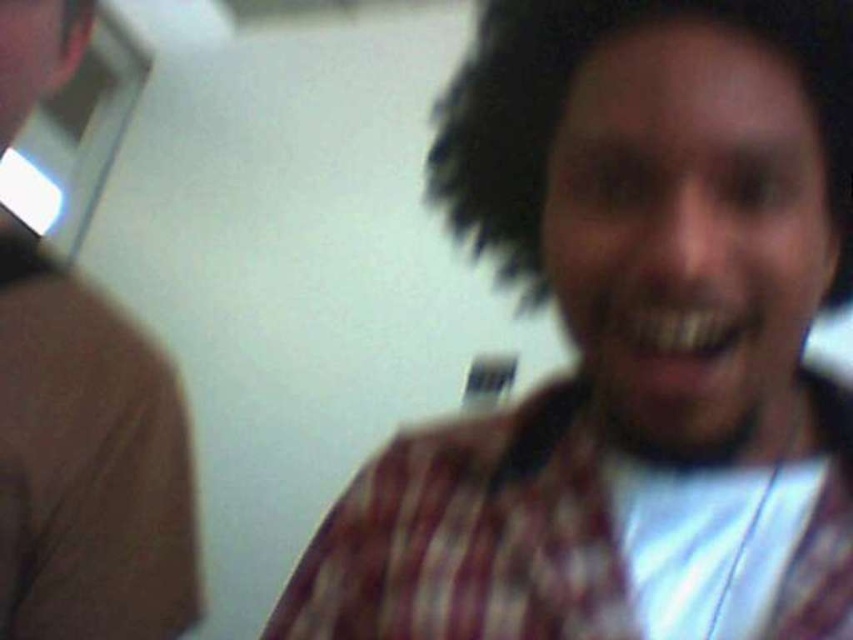
You are taking a photo of two people wearing the plaid shirt at center and the white cotton shirt at center. Which shirt will appear more in focus in the photo?

The plaid shirt at center will appear more in focus because it is closer to the viewer than the white cotton shirt at center, which is farther away.

You are trying to determine which object is closer to you in the image. The objects are the plaid shirt at center and the dark curly hair at center. According to the scene description, which one is closer?

The plaid shirt at center is closer to the viewer than dark curly hair at center.

You are trying to decide which clothing item to choose for a casual indoor event. Based on the image, which clothing item is shorter in height between the plaid shirt at center and the brown wool sweater at left?

The plaid shirt at center is shorter in height than the brown wool sweater at left according to the description.